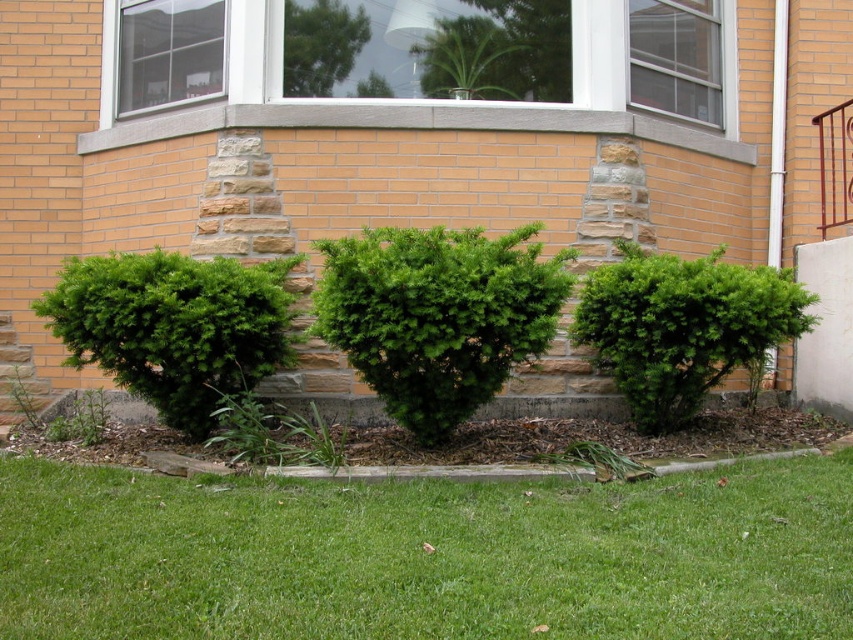
Who is shorter, green textured shrub at center or green textured bush at left?

green textured bush at left

Which is behind, point (416, 352) or point (111, 364)?

Positioned behind is point (111, 364).

Does point (381, 275) come in front of point (233, 291)?

Yes, it is in front of point (233, 291).

Where is `green textured shrub at center`? green textured shrub at center is located at coordinates (437, 316).

Is green grass at lower center thinner than green textured bush at left?

Incorrect, green grass at lower center's width is not less than green textured bush at left's.

Can you confirm if green grass at lower center is wider than green textured bush at left?

Correct, the width of green grass at lower center exceeds that of green textured bush at left.

Does point (701, 592) come closer to viewer compared to point (77, 262)?

Yes, it is in front of point (77, 262).

The image size is (853, 640). Find the location of `green grass at lower center`. green grass at lower center is located at coordinates (426, 556).

Who is lower down, green textured bush at left or green leafy bush at center?

green leafy bush at center is lower down.

Does point (204, 422) lie behind point (759, 365)?

That is False.

At what (x,y) coordinates should I click in order to perform the action: click on green textured bush at left. Please return your answer as a coordinate pair (x, y). The height and width of the screenshot is (640, 853). Looking at the image, I should click on (173, 326).